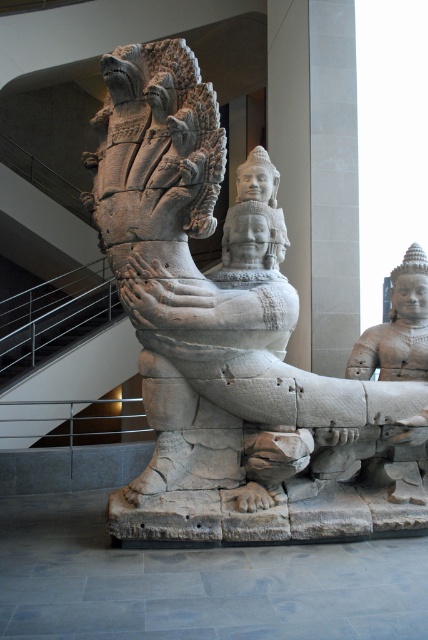
Question: Does white stone statue at center lie in front of metal/rail at left?

Choices:
 (A) yes
 (B) no

Answer: (A)

Question: Which object is farther from the camera taking this photo?

Choices:
 (A) metal/rail at left
 (B) white stone statue at center

Answer: (A)

Question: Observing the image, what is the correct spatial positioning of white stone statue at center in reference to metal/rail at left?

Choices:
 (A) right
 (B) left

Answer: (A)

Question: Does white stone statue at center appear under metal/rail at left?

Choices:
 (A) no
 (B) yes

Answer: (A)

Question: Which point is closer to the camera?

Choices:
 (A) white stone statue at center
 (B) metal/rail at left

Answer: (A)